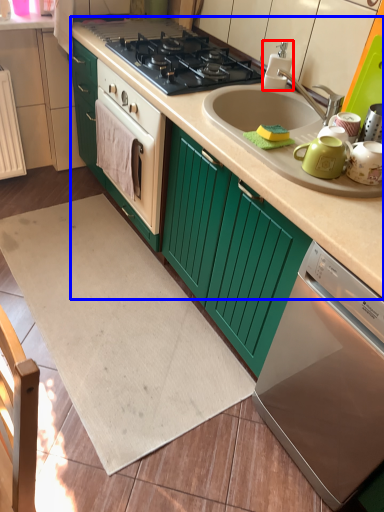
Question: Which object appears closest to the camera in this image, appliance (highlighted by a red box) or counter top (highlighted by a blue box)?

Choices:
 (A) appliance
 (B) counter top

Answer: (B)